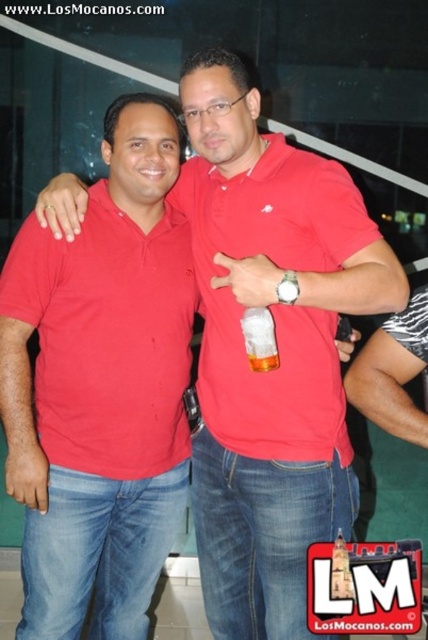
You are at a party and want to place the translucent plastic cup at center on the table next to the matte red polo shirt at left. Can you estimate if the cup will fit next to the shirt without overlapping?

The matte red polo shirt at left might be wider than the translucent plastic cup at center, so there is a possibility that placing the cup next to the shirt could result in overlapping. Check the exact dimensions before placing them.

You are at a party and need to decide which item is better suited for holding a drink. Based on their sizes, would you choose the matte red polo shirt at left or the translucent plastic cup at center?

The translucent plastic cup at center is better suited for holding a drink because it is shorter than the matte red polo shirt at left, making it more practical for containing liquids.

You are at a party and need to grab a drink. You see the matte red polo shirt at center and the translucent plastic cup at center. Which one is covering the other?

The matte red polo shirt at center is positioned over the translucent plastic cup at center, so the shirt is covering the cup.